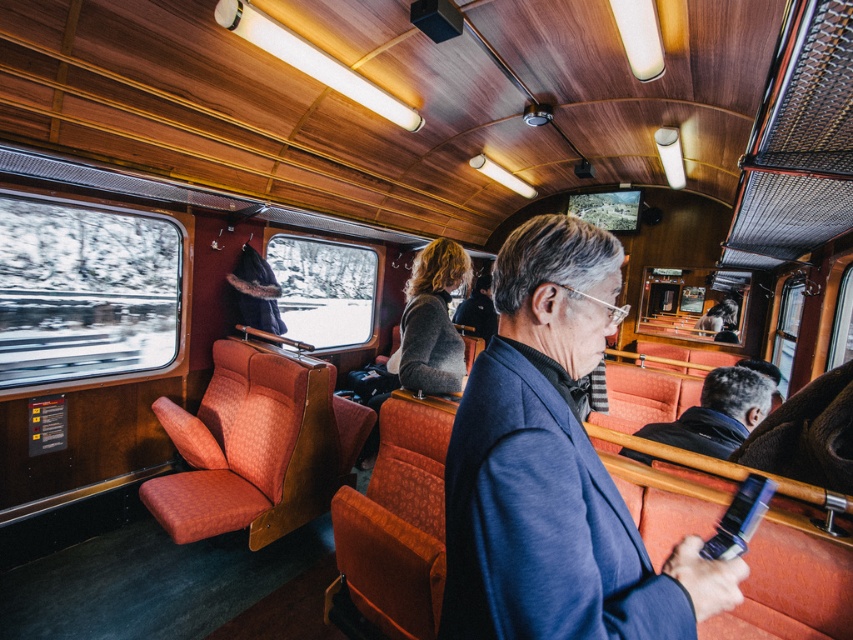
You are sitting in the train carriage and want to hand a book to the person wearing the dark gray sweater at center and the dark blue jacket at center. Which person is closer to you so you can reach them first without moving from your seat?

The dark gray sweater at center is closer to you, so you can reach them first without moving from your seat because they are further to the viewer than the dark blue jacket at center.

You are a photographer who wants to take a picture of the dark gray sweater at center from your camera. The minimum focusing distance of your camera is 7 feet. Can you take the photo without moving either the sweater or the camera?

The dark gray sweater at center and camera are 6.90 feet apart from each other, which is less than the minimum focusing distance of 7 feet. Therefore, you cannot take the photo without moving either the sweater or the camera.

You are a passenger sitting in the blue fabric coach at center and want to hand a book to someone wearing the dark blue jacket at center. In which direction should you move to reach them?

The blue fabric coach at center is to the left of the dark blue jacket at center. Therefore, you should move to your right to reach the person wearing the dark blue jacket at center.